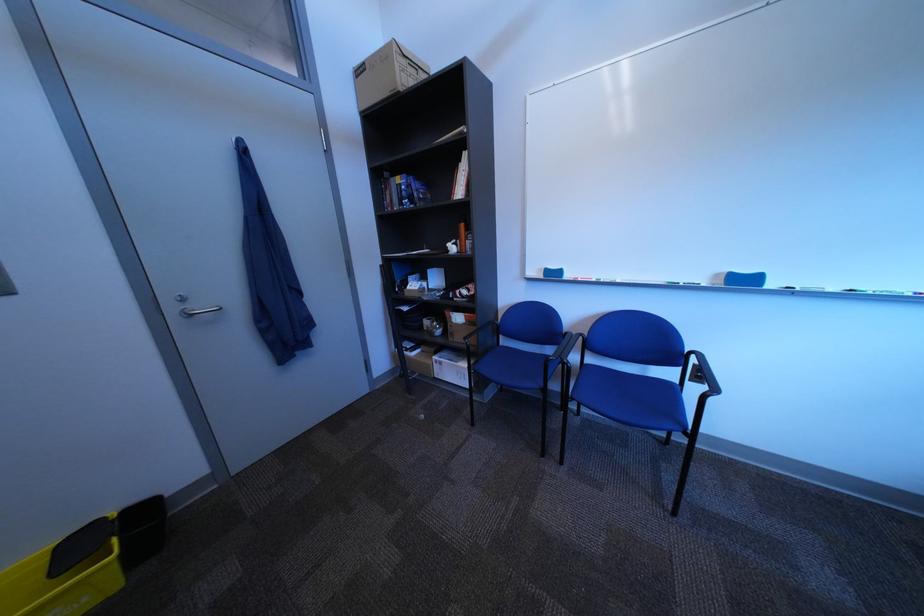
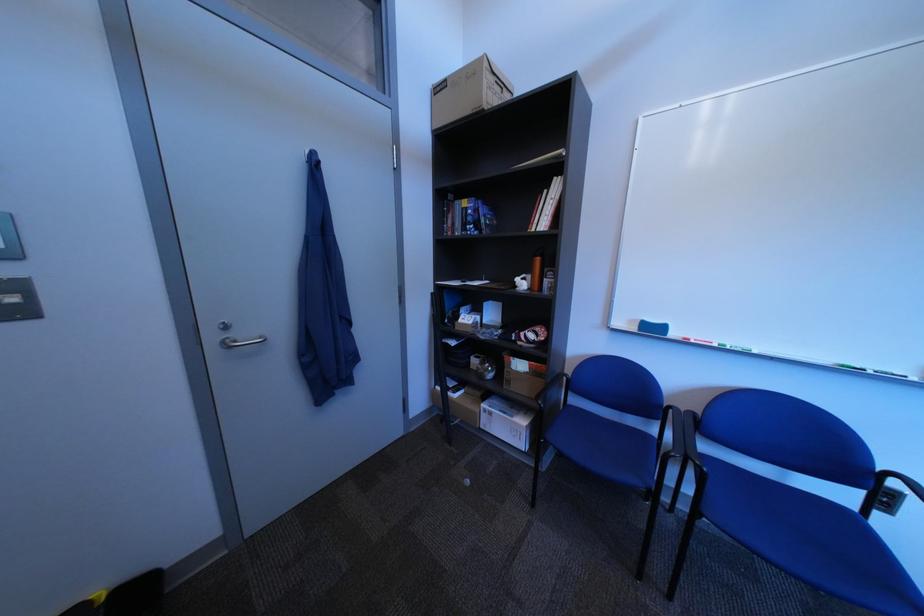
Locate, in the second image, the point that corresponds to [684,448] in the first image.

(840, 596)